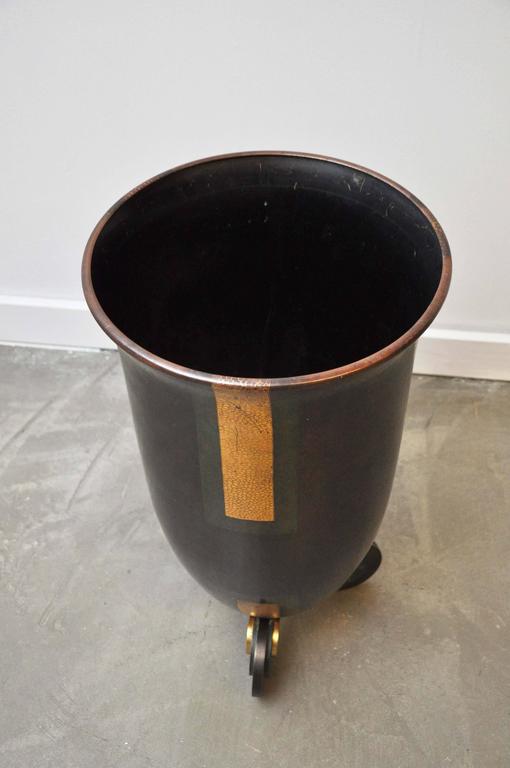
At what (x,y) coordinates should I click in order to perform the action: click on caulk. Please return your answer as a coordinate pair (x, y). This screenshot has height=768, width=510. Looking at the image, I should click on (76, 349).